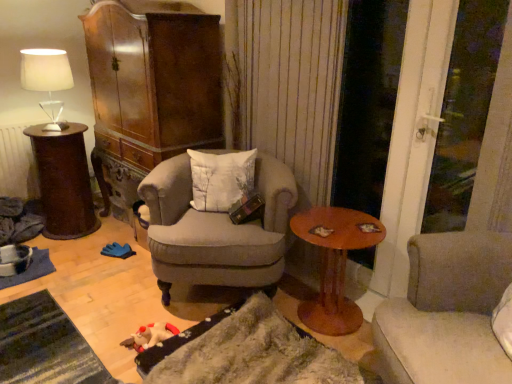
Find the location of a particular element. The width and height of the screenshot is (512, 384). vacant space situated on the left part of light gray fabric armchair at center is located at coordinates (91, 304).